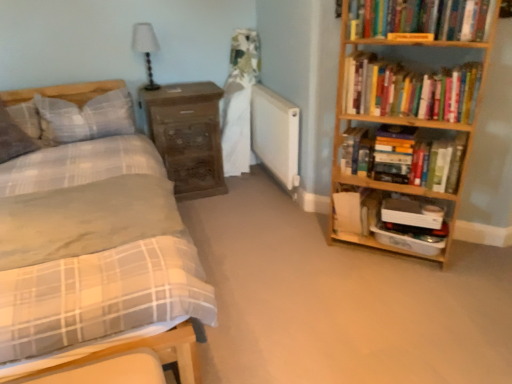
Locate an element on the screen. vacant space positioned to the left of wooden bookcase at right is located at coordinates (311, 254).